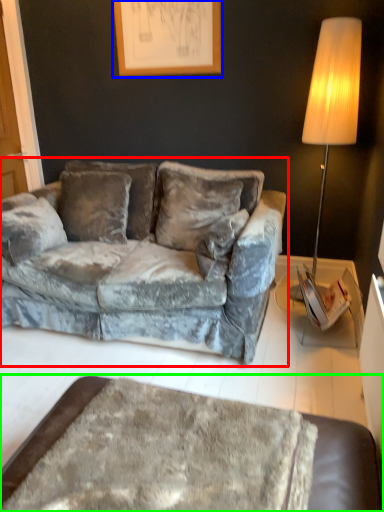
Question: Considering the real-world distances, which object is farthest from studio couch (highlighted by a red box)? picture frame (highlighted by a blue box) or table (highlighted by a green box)?

Choices:
 (A) picture frame
 (B) table

Answer: (B)